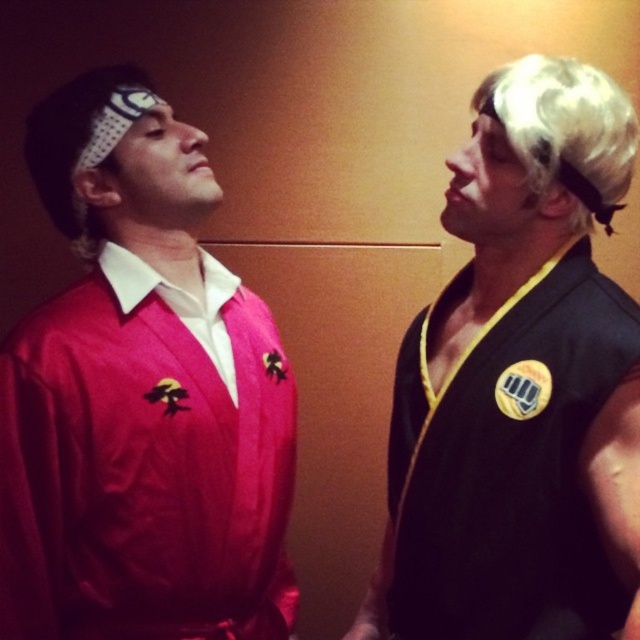
You are a fashion designer observing two items in the image. You need to decide their arrangement for a photoshoot. Which item is positioned to the left when looking at the matte pink sweater at left and the blonde synthetic wig at upper right?

The matte pink sweater at left is positioned to the left of the blonde synthetic wig at upper right.

You are a photographer setting up for a group photo. You notice the matte pink sweater at left and the blonde synthetic wig at upper right. Which object should you adjust to ensure both are fully visible in the frame?

The blonde synthetic wig at upper right is behind the matte pink sweater at left, so you should adjust the blonde synthetic wig at upper right to move it forward or reposition the matte pink sweater at left to allow both to be visible.